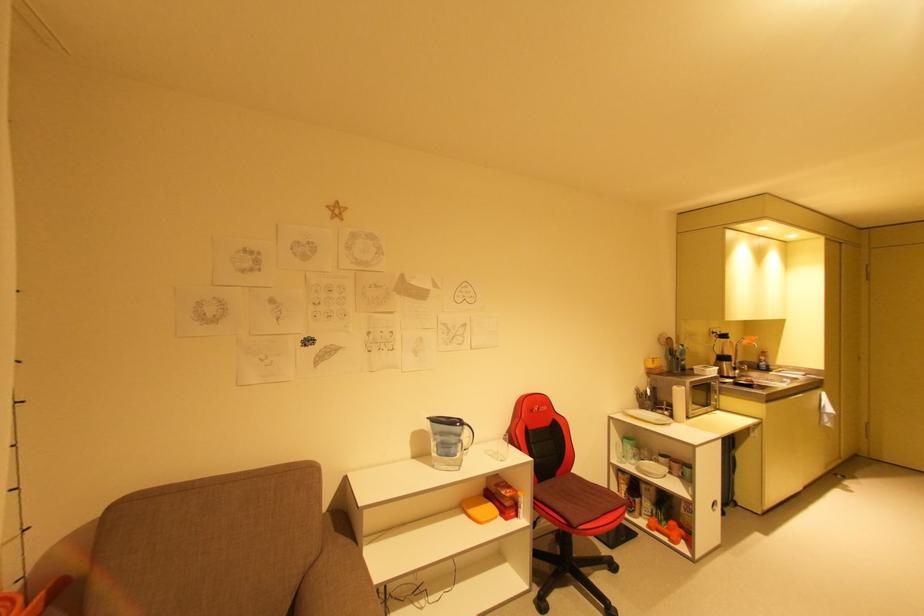
Which object does [667,530] point to?

It refers to a orange dumbbell.